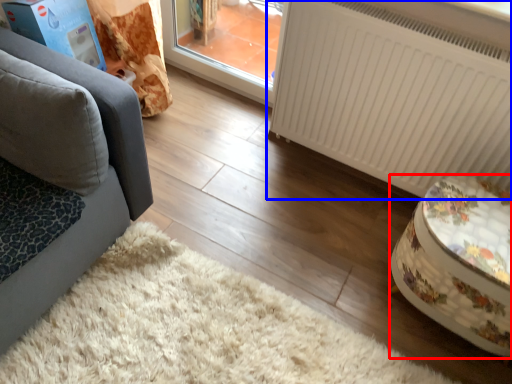
Question: Which of the following is the farthest to the observer, furniture (highlighted by a red box) or radiator (highlighted by a blue box)?

Choices:
 (A) furniture
 (B) radiator

Answer: (B)